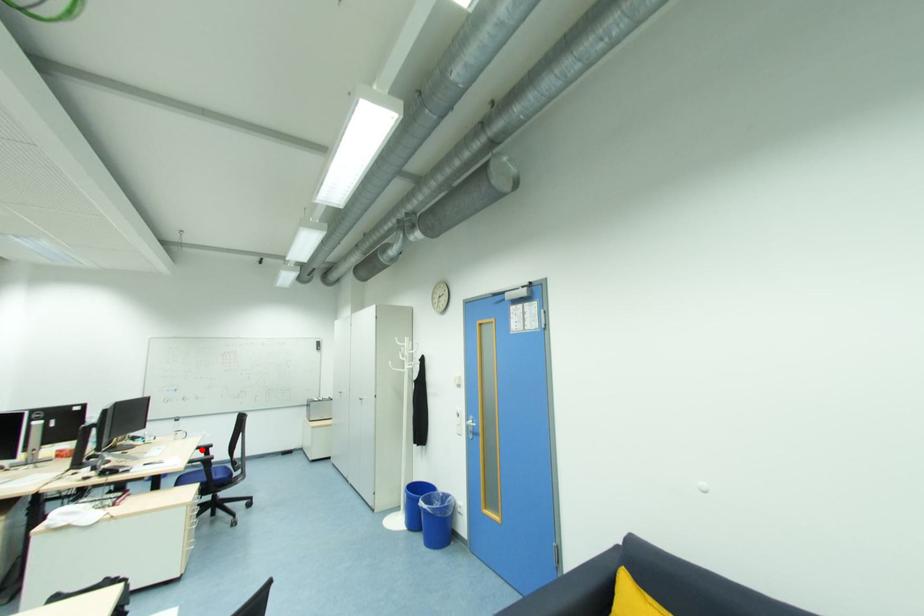
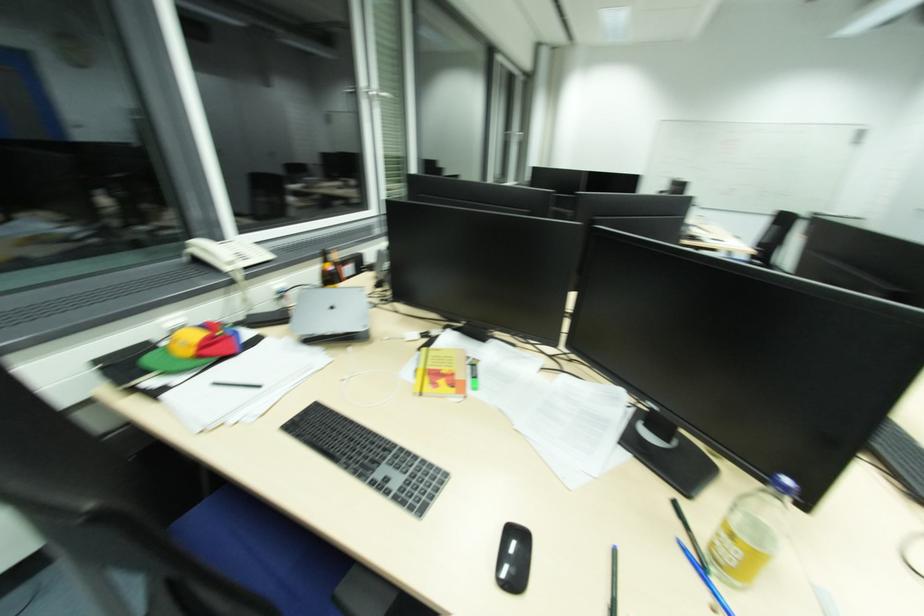
Question: I am providing you with two images of the same scene from different viewpoints. A red point is marked on the first image. Can you still see the location of the red point in image 2?

Choices:
 (A) Yes
 (B) No

Answer: (B)